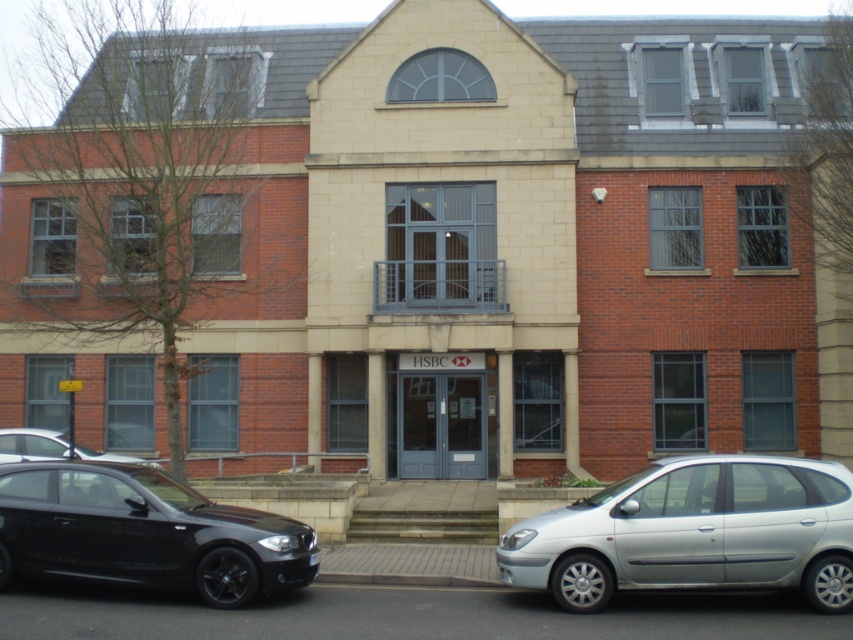
Who is more forward, [788,481] or [76,554]?

Point [788,481] is in front.

Can you confirm if silver metallic hatchback at lower right is thinner than shiny black car at lower left?

Incorrect, silver metallic hatchback at lower right's width is not less than shiny black car at lower left's.

Find the location of `silver metallic hatchback at lower right`. silver metallic hatchback at lower right is located at coordinates (694, 532).

The height and width of the screenshot is (640, 853). Identify the location of silver metallic hatchback at lower right. (694, 532).

In the scene shown: Which of these two, shiny black car at lower left or shiny black sedan at lower left, stands taller?

With more height is shiny black car at lower left.

Based on the photo, is shiny black car at lower left bigger than shiny black sedan at lower left?

Correct, shiny black car at lower left is larger in size than shiny black sedan at lower left.

Is point (280, 532) closer to viewer compared to point (76, 456)?

Yes, it is in front of point (76, 456).

The width and height of the screenshot is (853, 640). Identify the location of shiny black car at lower left. (144, 532).

Measure the distance between point (741, 483) and camera.

11.56 meters

Locate an element on the screen. The height and width of the screenshot is (640, 853). silver metallic hatchback at lower right is located at coordinates (694, 532).

Image resolution: width=853 pixels, height=640 pixels. What are the coordinates of `silver metallic hatchback at lower right` in the screenshot? It's located at (694, 532).